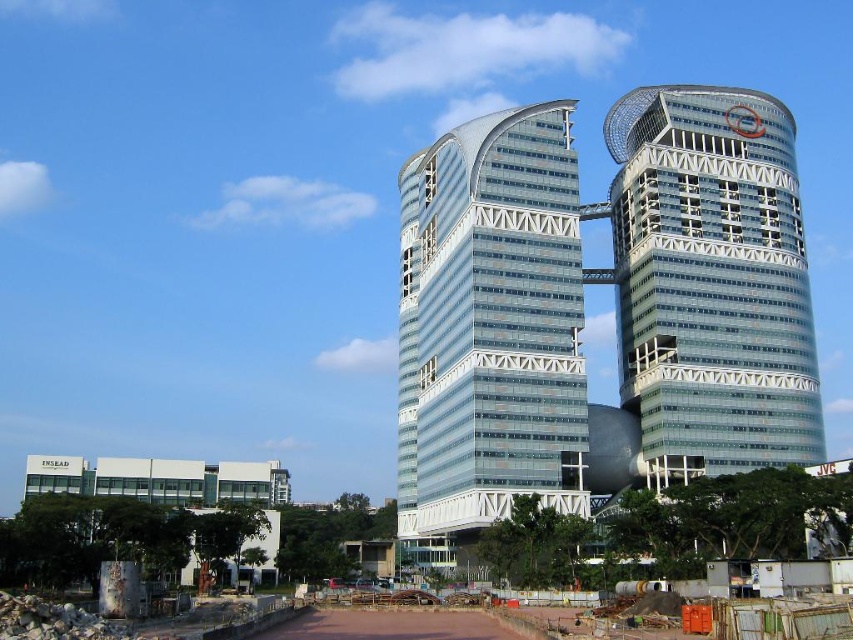
You are standing at the base of the interconnected towers and looking up. You notice two points marked on the structure. The first point is at coordinates point [451,472] and the second is at point [660,406]. Which point is closer to you when viewed from your current position?

Point [451,472] is in front of point [660,406], so it is closer to you when viewed from your current position.

Based on the scene description, where is the transparent glass building at center located in the image?

The transparent glass building at center is located at point (x=489, y=328).

You are an architect designing a new park between the transparent glass building at center and the transparent glass tower at upper right. The park must be exactly 50 feet wide. Can you fit the park between them without any overlap?

The transparent glass building at center and transparent glass tower at upper right are 51.95 feet apart. Since the park needs to be 50 feet wide, there is enough space to fit the park between them without overlap, leaving approximately 1.95 feet of extra space.